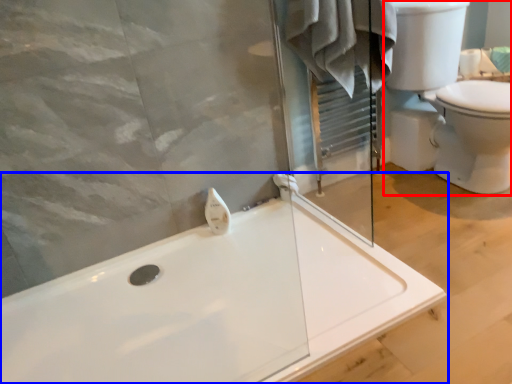
Question: Which object is closer to the camera taking this photo, sink (highlighted by a red box) or bathtub (highlighted by a blue box)?

Choices:
 (A) sink
 (B) bathtub

Answer: (B)